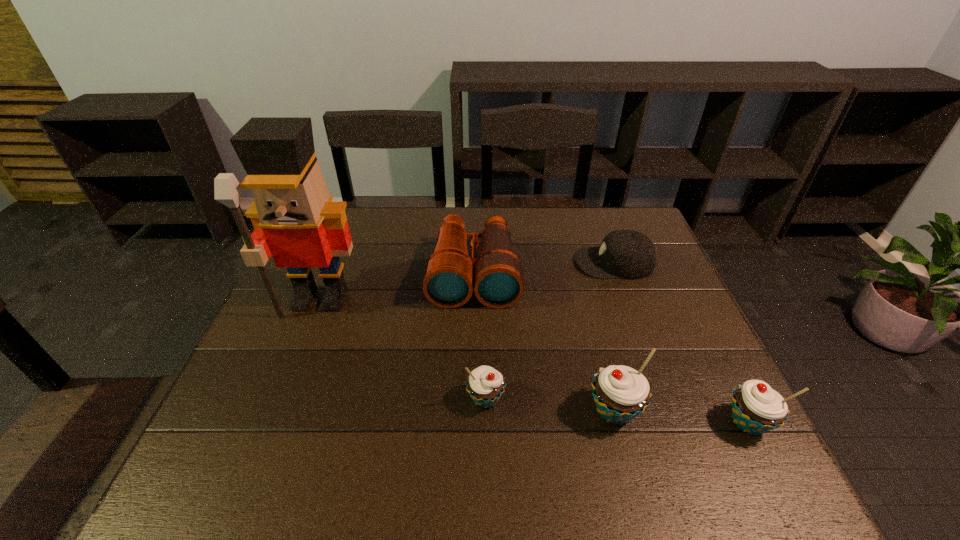
The height and width of the screenshot is (540, 960). I want to click on unoccupied position between the shortest cupcake and the binoculars, so click(x=480, y=336).

Locate an element on the screen. The height and width of the screenshot is (540, 960). free space between the nutcracker and the binoculars is located at coordinates (397, 287).

Identify the location of free point between the binoculars and the second shortest cupcake. The width and height of the screenshot is (960, 540). (611, 348).

Identify the location of vacant space in between the cap and the binoculars. The height and width of the screenshot is (540, 960). (544, 268).

At what (x,y) coordinates should I click in order to perform the action: click on vacant area between the leftmost object and the leftmost cupcake. Please return your answer as a coordinate pair (x, y). Image resolution: width=960 pixels, height=540 pixels. Looking at the image, I should click on (403, 349).

Find the location of `free space between the nutcracker and the binoculars`. free space between the nutcracker and the binoculars is located at coordinates (397, 287).

You are a GUI agent. You are given a task and a screenshot of the screen. Output one action in this format:
    pyautogui.click(x=<x>, y=<y>)
    Task: Click on the free space that is in between the leftmost cupcake and the tallest object
    The width and height of the screenshot is (960, 540).
    Given the screenshot: What is the action you would take?
    pyautogui.click(x=403, y=349)

The image size is (960, 540). I want to click on object that is the fifth nearest to the cap, so click(294, 219).

What are the coordinates of `object that is the second closest to the binoculars` in the screenshot? It's located at (294, 219).

Locate which cupcake ranks second in proximity to the tallest object. Please provide its 2D coordinates. Your answer should be formatted as a tuple, i.e. [(x, y)], where the tuple contains the x and y coordinates of a point satisfying the conditions above.

[(621, 393)]